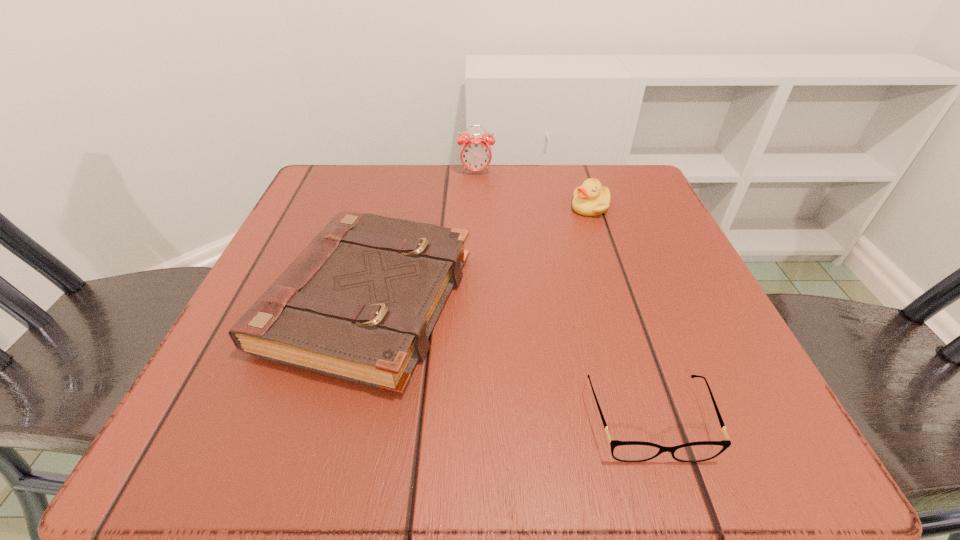
Identify the location of free spot between the spectacles and the tallest object. (563, 296).

Where is `unoccupied area between the alarm clock and the duckling`? The width and height of the screenshot is (960, 540). unoccupied area between the alarm clock and the duckling is located at coordinates (533, 190).

Locate an element on the screen. The height and width of the screenshot is (540, 960). free area in between the duckling and the spectacles is located at coordinates (619, 314).

The image size is (960, 540). What are the coordinates of `vacant space that is in between the hardback book and the spectacles` in the screenshot? It's located at (508, 361).

Identify the location of object that is the second closest to the hardback book. (590, 199).

At what (x,y) coordinates should I click in order to perform the action: click on object that is the third nearest to the alarm clock. Please return your answer as a coordinate pair (x, y). Looking at the image, I should click on (625, 451).

Identify the location of vacant space that satisfies the following two spatial constraints: 1. on the front-facing side of the second farthest object; 2. on the front-facing side of the spectacles. Image resolution: width=960 pixels, height=540 pixels. (661, 420).